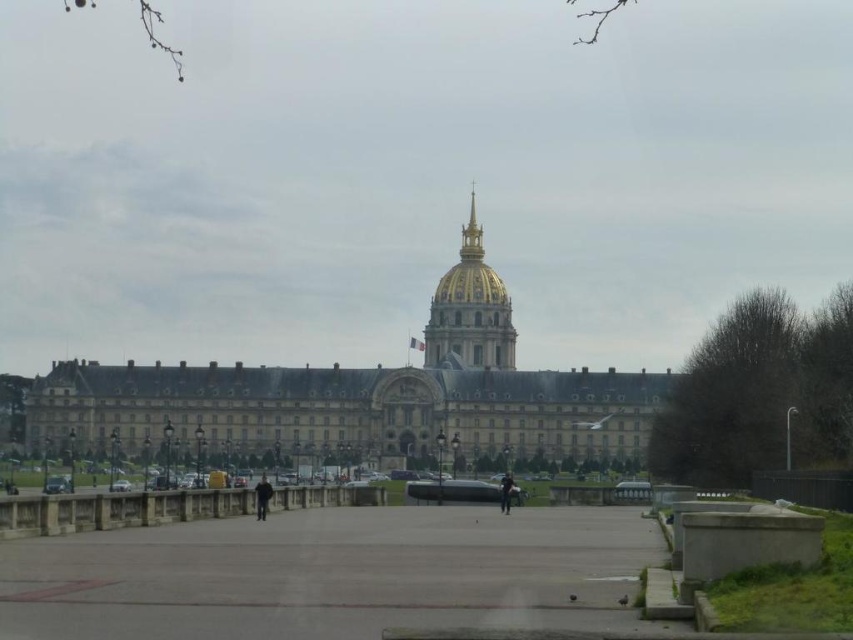
Identify the location of dark gray stone building at center. (363, 397).

Is dark gray stone building at center behind black fabric person at center?

Yes, dark gray stone building at center is further from the viewer.

Where is `dark gray stone building at center`? dark gray stone building at center is located at coordinates (363, 397).

Does dark gray stone building at center come behind black matte jacket at center?

Yes, dark gray stone building at center is behind black matte jacket at center.

Who is lower down, dark gray stone building at center or black matte jacket at center?

black matte jacket at center

The image size is (853, 640). Describe the element at coordinates (363, 397) in the screenshot. I see `dark gray stone building at center` at that location.

Identify the location of dark gray stone building at center. (363, 397).

Does black matte jacket at center lie in front of black fabric person at center?

Yes, it is in front of black fabric person at center.

Between black matte jacket at center and black fabric person at center, which one has more height?

Standing taller between the two is black matte jacket at center.

The image size is (853, 640). Identify the location of black matte jacket at center. (262, 497).

Locate an element on the screen. Image resolution: width=853 pixels, height=640 pixels. black matte jacket at center is located at coordinates (262, 497).